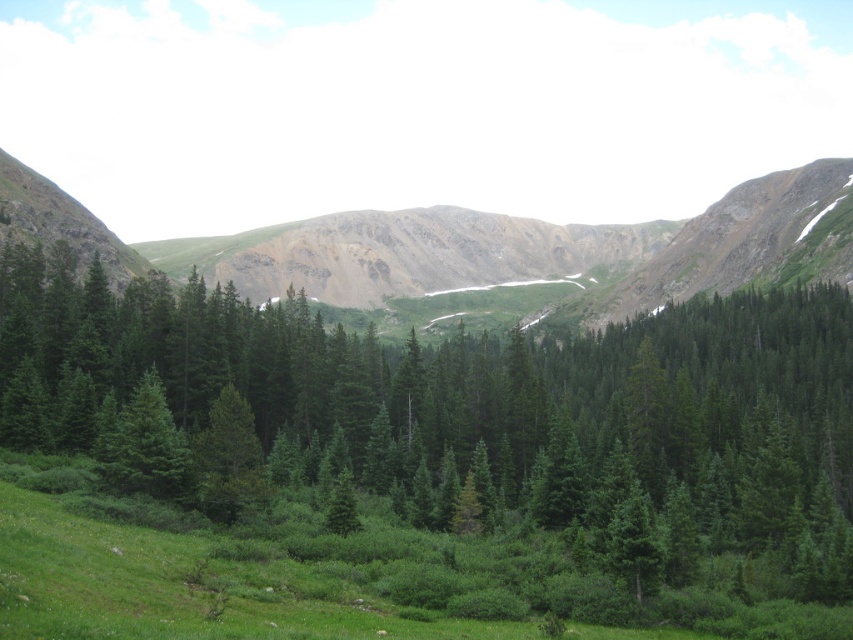
Based on the photo, you are a hiker planning to traverse the landscape shown. You need to determine which area is shorter in height between the green matte pine forest at center and the green grassy mountain at center. Which one should you choose for a shorter climb?

The green matte pine forest at center has a lesser height compared to the green grassy mountain at center, so you should choose the green matte pine forest at center for a shorter climb.

You are standing at the point labeled point (483, 252) in the mountainous landscape. What type of terrain are you currently standing on?

The point (483, 252) corresponds to the green grassy mountain at center, so you are standing on green grassy mountain terrain.